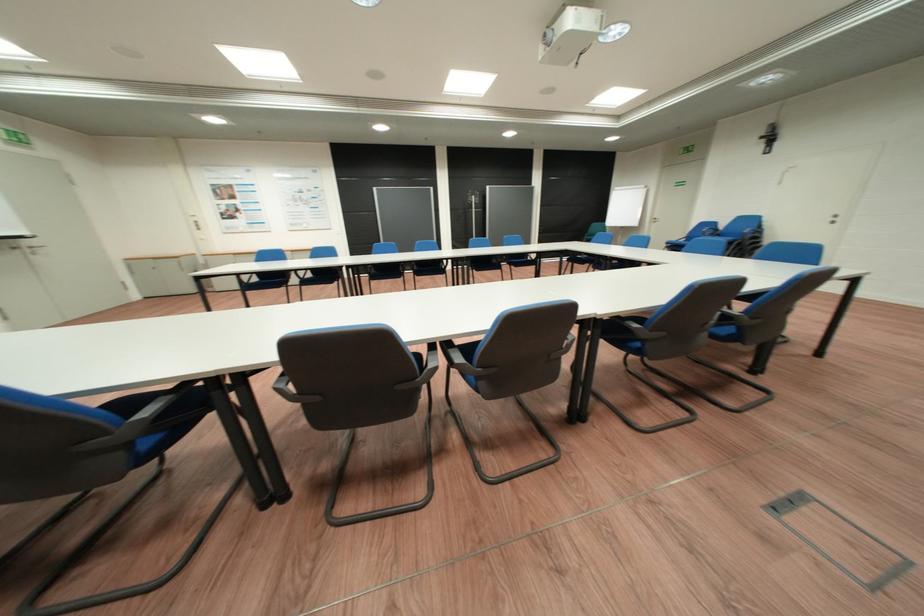
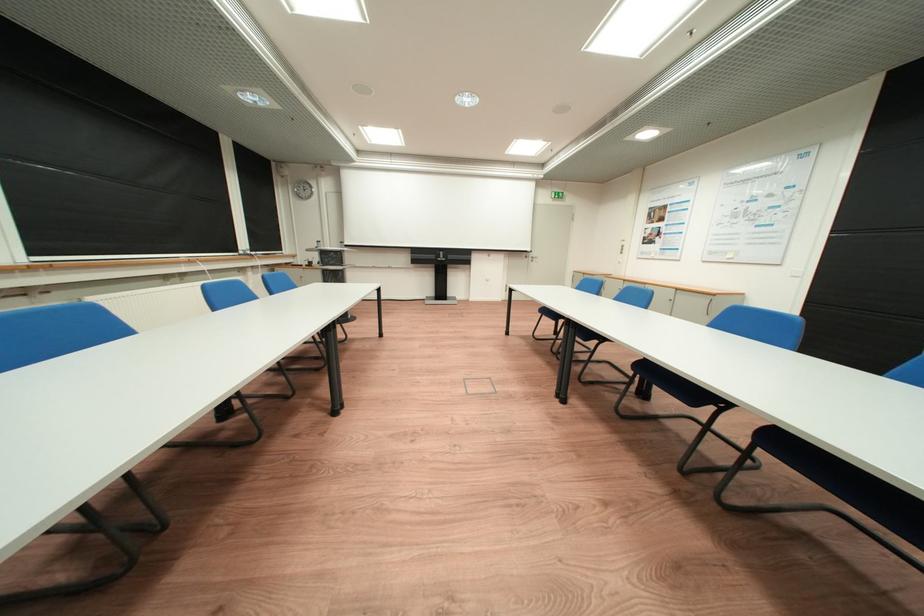
Question: I am providing you with two images of the same scene from different viewpoints. Which of the following objects are not visible in image2?

Choices:
 (A) cabinet handle
 (B) blue chair sitting surface
 (C) black chair armrest
 (D) small pink box

Answer: (C)